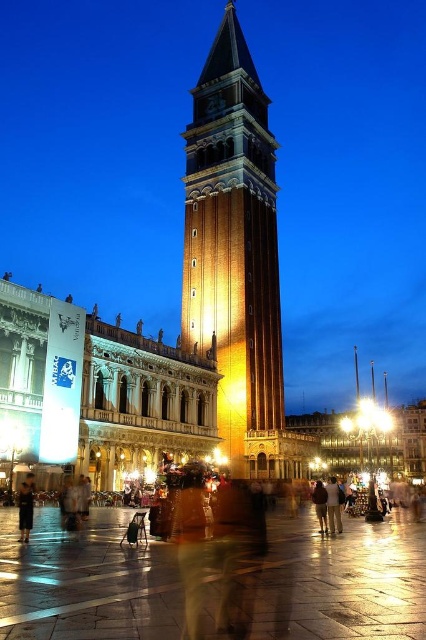
You are a tourist standing in St. Mark Square, Venice. You have a dark brown leather jacket at lower left and a dark brown backpack at center. Which item is shorter?

The dark brown leather jacket at lower left is shorter than the dark brown backpack at center.